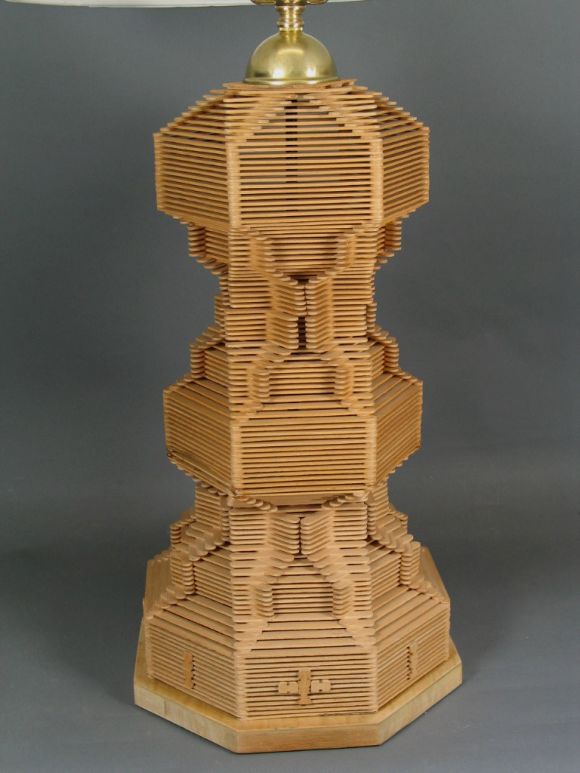
The height and width of the screenshot is (773, 580). I want to click on wall, so click(x=494, y=472).